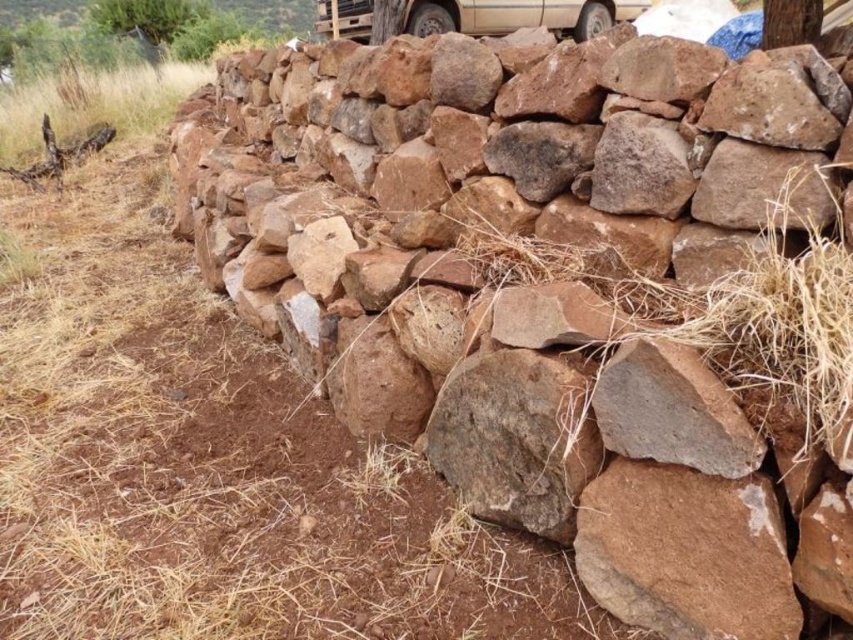
Which is behind, point (335, 4) or point (772, 29)?

The point (335, 4) is behind.

In the scene shown: Is beige matte truck at upper center taller than brown rough tree trunk at upper right?

Indeed, beige matte truck at upper center has a greater height compared to brown rough tree trunk at upper right.

At what (x,y) coordinates should I click in order to perform the action: click on beige matte truck at upper center. Please return your answer as a coordinate pair (x, y). The image size is (853, 640). Looking at the image, I should click on (517, 16).